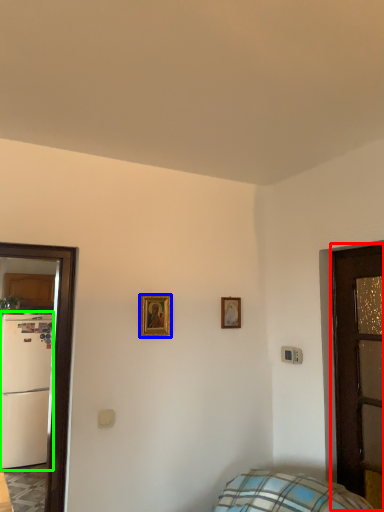
Question: Which object is positioned closest to door (highlighted by a red box)? Select from picture frame (highlighted by a blue box) and fridge (highlighted by a green box).

Choices:
 (A) picture frame
 (B) fridge

Answer: (A)